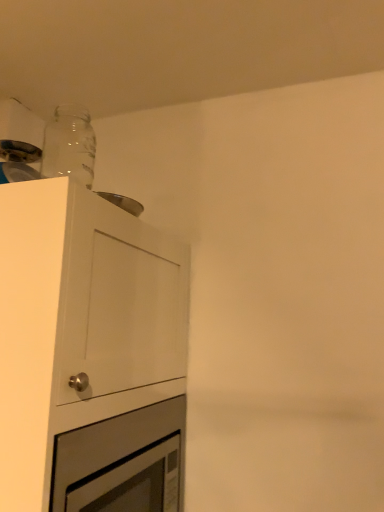
Question: Visually, is silver metallic oven at lower left positioned to the left or to the right of white matte cabinet at upper left?

Choices:
 (A) right
 (B) left

Answer: (A)

Question: Considering the positions of silver metallic oven at lower left and white matte cabinet at upper left in the image, is silver metallic oven at lower left wider or thinner than white matte cabinet at upper left?

Choices:
 (A) wide
 (B) thin

Answer: (B)

Question: Which object is positioned farthest from the transparent glass bottle at upper left?

Choices:
 (A) silver metallic oven at lower left
 (B) white matte cabinet at upper left

Answer: (A)

Question: Estimate the real-world distances between objects in this image. Which object is farther from the silver metallic oven at lower left?

Choices:
 (A) white matte cabinet at upper left
 (B) transparent glass bottle at upper left

Answer: (B)